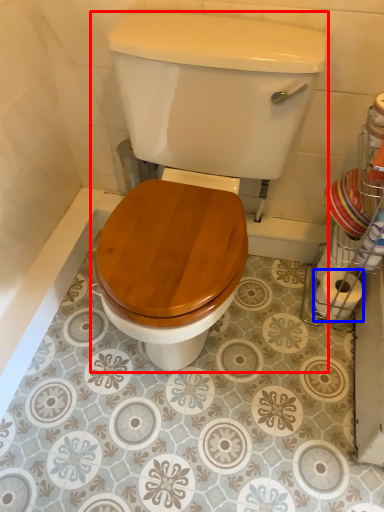
Question: Which object appears farthest to the camera in this image, toilet (highlighted by a red box) or toilet paper (highlighted by a blue box)?

Choices:
 (A) toilet
 (B) toilet paper

Answer: (B)